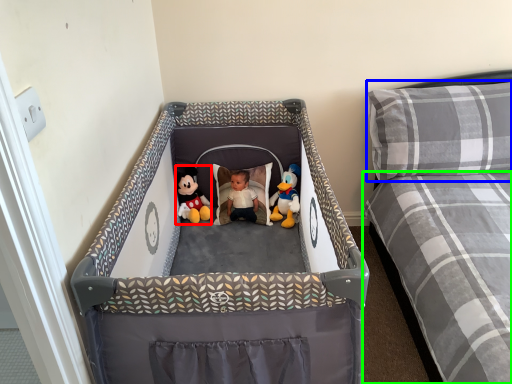
Question: Based on their relative distances, which object is farther from toy (highlighted by a red box)? Choose from pillow (highlighted by a blue box) and mattress (highlighted by a green box).

Choices:
 (A) pillow
 (B) mattress

Answer: (B)